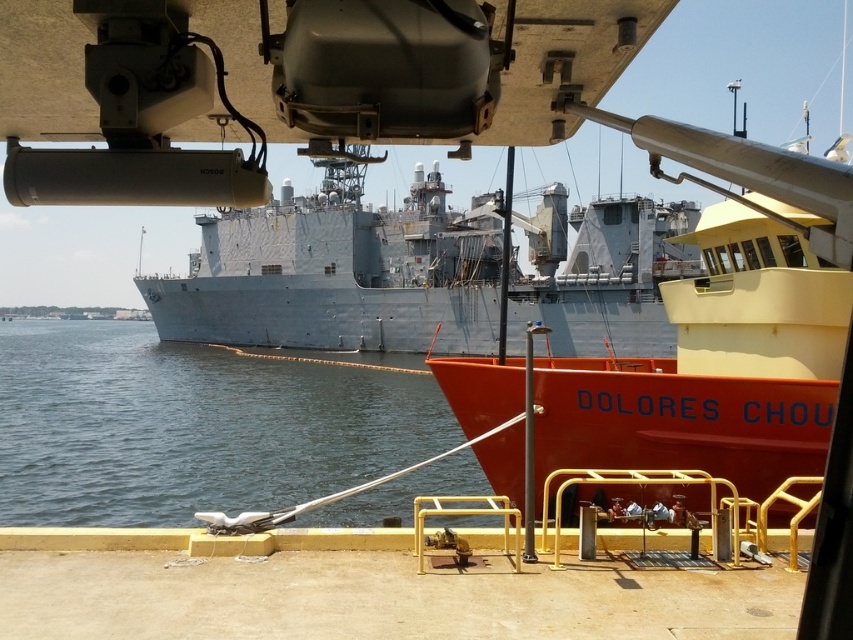
Question: Which of the following is the farthest from the observer?

Choices:
 (A) (112, 355)
 (B) (254, 218)
 (C) (679, 397)

Answer: (A)

Question: Which point appears closest to the camera in this image?

Choices:
 (A) (558, 184)
 (B) (741, 301)
 (C) (114, 433)

Answer: (B)

Question: Is orange matte boat at center in front of clear water at center?

Choices:
 (A) yes
 (B) no

Answer: (A)

Question: Estimate the real-world distances between objects in this image. Which object is closer to the gray matte ship at center?

Choices:
 (A) clear water at center
 (B) orange matte boat at center

Answer: (A)

Question: Can you confirm if orange matte boat at center is thinner than clear water at center?

Choices:
 (A) yes
 (B) no

Answer: (A)

Question: Is orange matte boat at center closer to the viewer compared to gray matte ship at center?

Choices:
 (A) no
 (B) yes

Answer: (B)